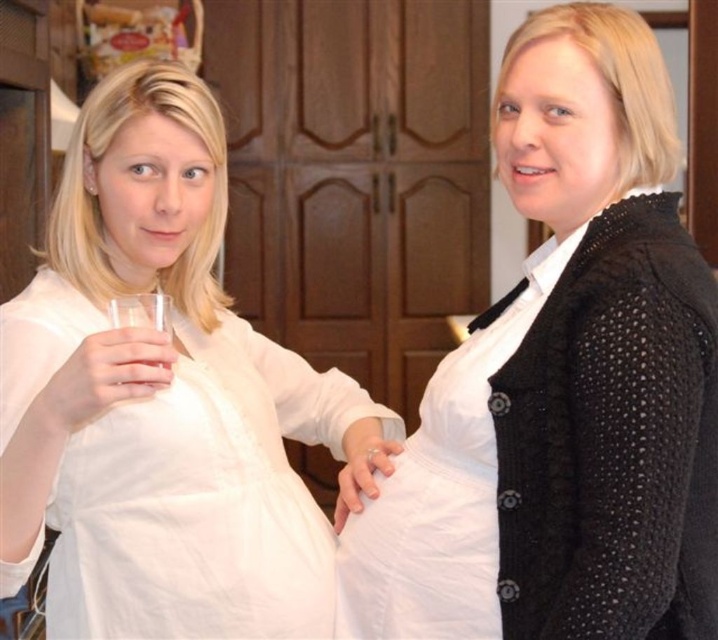
Between white matte shirt at center and clear glass at center, which one appears on the left side from the viewer's perspective?

clear glass at center

Who is more distant from viewer, (696,432) or (139,316)?

Positioned behind is point (696,432).

At what (x,y) coordinates should I click in order to perform the action: click on white matte shirt at center. Please return your answer as a coordinate pair (x, y). Looking at the image, I should click on (564, 384).

Is white matte shirt at center taller than white cotton shirt at left?

Correct, white matte shirt at center is much taller as white cotton shirt at left.

Is white matte shirt at center below white cotton shirt at left?

Incorrect, white matte shirt at center is not positioned below white cotton shirt at left.

Who is more distant from viewer, (691, 248) or (177, 132)?

The point (177, 132) is behind.

Where is `white matte shirt at center`? The width and height of the screenshot is (718, 640). white matte shirt at center is located at coordinates (564, 384).

Which is behind, point (111, 596) or point (167, 305)?

The point (111, 596) is more distant.

Identify the location of white cotton shirt at left. The width and height of the screenshot is (718, 640). (163, 400).